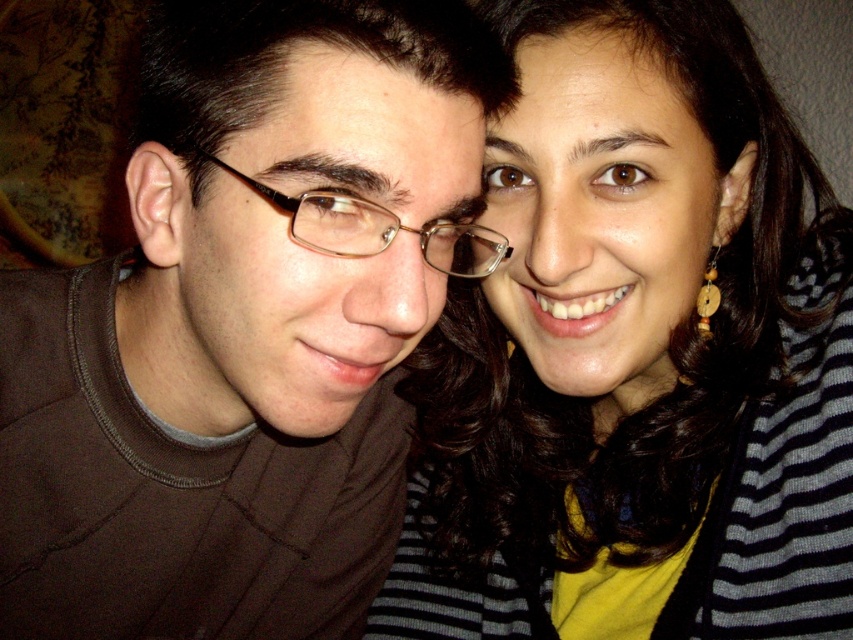
Which is more to the left, matte brown shirt at center or striped sweater at upper right?

Positioned to the left is matte brown shirt at center.

Can you confirm if matte brown shirt at center is bigger than striped sweater at upper right?

No, matte brown shirt at center is not bigger than striped sweater at upper right.

From the picture: Measure the distance between matte brown shirt at center and camera.

matte brown shirt at center is 16.36 inches from camera.

Find the location of a particular element. matte brown shirt at center is located at coordinates (244, 326).

Who is taller, matte brown shirt at center or wooden round earring at right?

matte brown shirt at center is taller.

Who is more distant from viewer, (314, 552) or (711, 333)?

The point (314, 552) is behind.

Where is `matte brown shirt at center`? This screenshot has width=853, height=640. matte brown shirt at center is located at coordinates (244, 326).

Is gold metallic glasses at center shorter than wooden round earring at right?

In fact, gold metallic glasses at center may be taller than wooden round earring at right.

Which is in front, point (305, 196) or point (711, 314)?

Point (305, 196)

The height and width of the screenshot is (640, 853). In order to click on gold metallic glasses at center in this screenshot , I will do `click(376, 228)`.